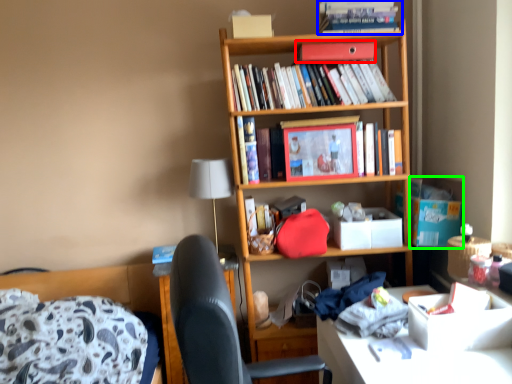
Question: Estimate the real-world distances between objects in this image. Which object is farther from paperback book (highlighted by a red box), book (highlighted by a blue box) or cardboard box (highlighted by a green box)?

Choices:
 (A) book
 (B) cardboard box

Answer: (B)